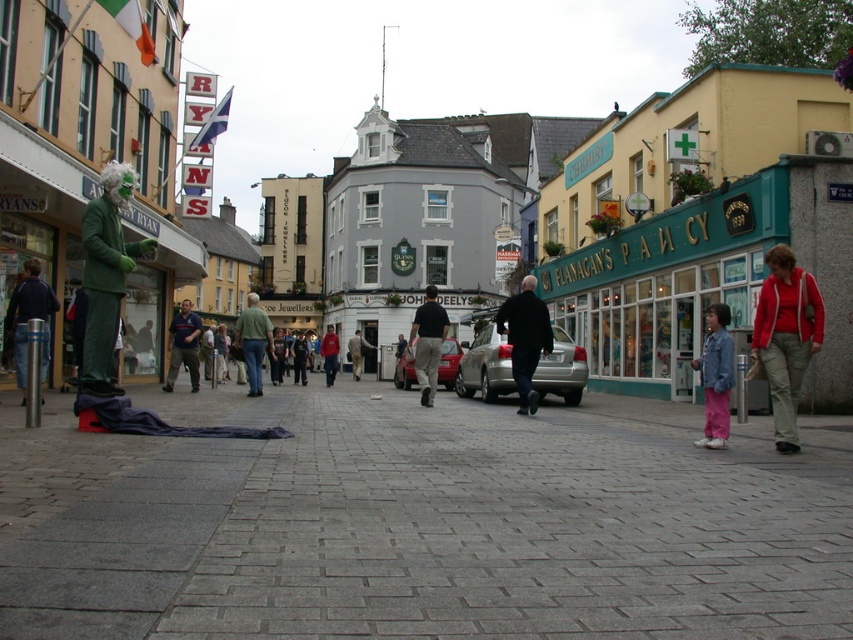
Which is more to the left, gray stone pavement at center or dark gray pants at center?

dark gray pants at center is more to the left.

Does gray stone pavement at center have a smaller size compared to dark gray pants at center?

Indeed, gray stone pavement at center has a smaller size compared to dark gray pants at center.

The image size is (853, 640). Describe the element at coordinates (419, 528) in the screenshot. I see `gray stone pavement at center` at that location.

At what (x,y) coordinates should I click in order to perform the action: click on gray stone pavement at center. Please return your answer as a coordinate pair (x, y). Looking at the image, I should click on (419, 528).

Does point (717, 355) come closer to viewer compared to point (431, 403)?

Yes, point (717, 355) is closer to viewer.

Can you confirm if denim jacket at lower right is shorter than dark gray pants at center?

Yes.

Who is more forward, (706, 435) or (422, 333)?

Point (706, 435) is more forward.

The width and height of the screenshot is (853, 640). I want to click on denim jacket at lower right, so click(x=717, y=376).

Which is behind, point (399, 632) or point (820, 298)?

The point (820, 298) is behind.

Is point (219, 474) positioned behind point (784, 401)?

No, (219, 474) is closer to viewer.

Describe the element at coordinates (419, 528) in the screenshot. I see `gray stone pavement at center` at that location.

You are a GUI agent. You are given a task and a screenshot of the screen. Output one action in this format:
    pyautogui.click(x=<x>, y=<y>)
    Task: Click on the gray stone pavement at center
    This screenshot has height=640, width=853.
    Given the screenshot: What is the action you would take?
    pyautogui.click(x=419, y=528)